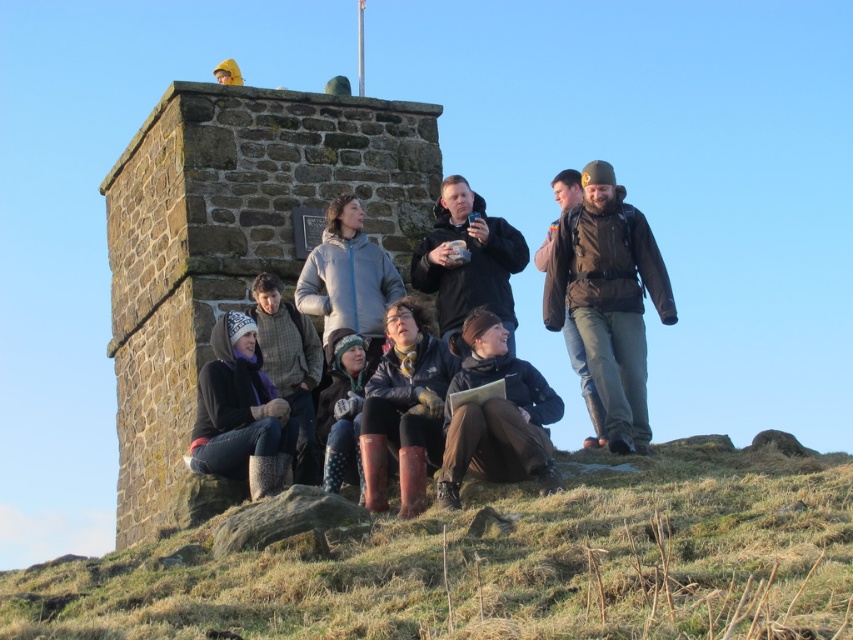
This screenshot has width=853, height=640. Describe the element at coordinates (502, 563) in the screenshot. I see `brown grass at lower right` at that location.

At what (x,y) coordinates should I click in order to perform the action: click on brown grass at lower right. Please return your answer as a coordinate pair (x, y). The height and width of the screenshot is (640, 853). Looking at the image, I should click on (502, 563).

Is point (380, 344) farther from camera compared to point (219, 76)?

No, it is not.

Can you confirm if matte gray jacket at center is positioned to the right of yellow hooded jacket at center?

Yes, matte gray jacket at center is to the right of yellow hooded jacket at center.

Does point (379, 353) lie behind point (227, 67)?

No, it is in front of (227, 67).

Where is `matte gray jacket at center`? Image resolution: width=853 pixels, height=640 pixels. matte gray jacket at center is located at coordinates (347, 276).

Can you confirm if brown matte jacket at center is positioned to the left of brown leather jacket at upper right?

Correct, you'll find brown matte jacket at center to the left of brown leather jacket at upper right.

Between brown matte jacket at center and brown leather jacket at upper right, which one is positioned lower?

Positioned lower is brown matte jacket at center.

This screenshot has height=640, width=853. What do you see at coordinates (608, 298) in the screenshot?
I see `brown matte jacket at center` at bounding box center [608, 298].

The image size is (853, 640). Find the location of `brown matte jacket at center`. brown matte jacket at center is located at coordinates (608, 298).